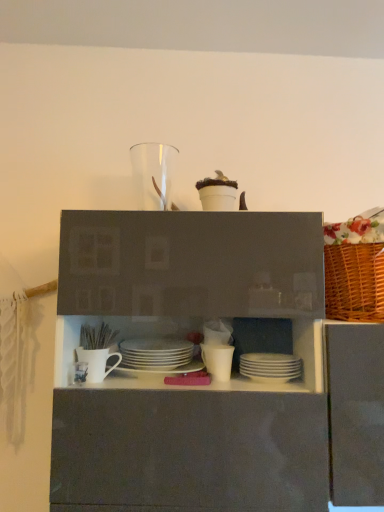
The width and height of the screenshot is (384, 512). Describe the element at coordinates (218, 360) in the screenshot. I see `white matte cup at center, the fifth tableware positioned from the left` at that location.

At what (x,y) coordinates should I click in order to perform the action: click on transparent glass vase at upper center, which is counted as the 6th tableware, starting from the bottom. Please return your answer as a coordinate pair (x, y). Looking at the image, I should click on (153, 174).

The image size is (384, 512). What do you see at coordinates (80, 372) in the screenshot? I see `white matte mug at center, acting as the 4th tableware starting from the top` at bounding box center [80, 372].

Where is `white matte mug at center, acting as the 3th tableware starting from the bottom`? The image size is (384, 512). white matte mug at center, acting as the 3th tableware starting from the bottom is located at coordinates (80, 372).

The width and height of the screenshot is (384, 512). I want to click on white matte mug at center, the 5th tableware from the right, so click(97, 362).

Could you tell me if white matte plates at center, which appears as the 1th tableware when viewed from the right, is turned towards white matte cup at center, the second tableware from the right?

No, white matte plates at center, which appears as the 1th tableware when viewed from the right, is not turned towards white matte cup at center, the second tableware from the right.

Which object is thinner, white matte plates at center, the 1th tableware ordered from the bottom, or white matte cup at center, the second tableware from the right?

With smaller width is white matte plates at center, the 1th tableware ordered from the bottom.

Are white matte plates at center, which is the 6th tableware from left to right, and white matte cup at center, the 2th tableware from the bottom, located far from each other?

They are positioned close to each other.

From a real-world perspective, is white glossy plates at center, arranged as the 3th tableware when viewed from the top, physically located above or below white matte mug at center, arranged as the 6th tableware when viewed from the right?

white glossy plates at center, arranged as the 3th tableware when viewed from the top, is above white matte mug at center, arranged as the 6th tableware when viewed from the right.

Which object is positioned more to the left, white glossy plates at center, arranged as the 3th tableware when viewed from the top, or white matte mug at center, the 1th tableware viewed from the left?

white matte mug at center, the 1th tableware viewed from the left, is more to the left.

From the image's perspective, count 1st tablewares downward from the white glossy plates at center, arranged as the 3th tableware when viewed from the top, and point to it. Please provide its 2D coordinates.

[(80, 372)]

Are white glossy plates at center, arranged as the 3th tableware when viewed from the top, and white matte mug at center, the 1th tableware viewed from the left, beside each other?

No, white glossy plates at center, arranged as the 3th tableware when viewed from the top, is not next to white matte mug at center, the 1th tableware viewed from the left.

From a real-world perspective, which tableware is the 4th one above the white matte plates at center, the sixth tableware positioned from the top? Please provide its 2D coordinates.

[(156, 353)]

Which is behind, point (250, 356) or point (156, 361)?

The point (156, 361) is more distant.

Which of these two, white matte plates at center, the 1th tableware ordered from the bottom, or white glossy plates at center, arranged as the 3th tableware when viewed from the top, is bigger?

With larger size is white glossy plates at center, arranged as the 3th tableware when viewed from the top.

Who is taller, white matte plates at center, the sixth tableware positioned from the top, or white glossy plates at center, marked as the fourth tableware in a bottom-to-top arrangement?

white matte plates at center, the sixth tableware positioned from the top.

From the image's perspective, would you say white matte mug at center, which is the second tableware from top to bottom, is positioned over white matte mug at center, acting as the 3th tableware starting from the bottom?

Correct, white matte mug at center, which is the second tableware from top to bottom, appears higher than white matte mug at center, acting as the 3th tableware starting from the bottom, in the image.

How many degrees apart are the facing directions of white matte mug at center, which is the second tableware from top to bottom, and white matte mug at center, acting as the 4th tableware starting from the top?

The angle between the facing direction of white matte mug at center, which is the second tableware from top to bottom, and the facing direction of white matte mug at center, acting as the 4th tableware starting from the top, is 0.000236 degrees.

Is white matte mug at center, arranged as the 6th tableware when viewed from the right, a part of white matte mug at center, which is the second tableware from top to bottom?

No, white matte mug at center, arranged as the 6th tableware when viewed from the right, is located outside of white matte mug at center, which is the second tableware from top to bottom.

Would you say white matte mug at center, which is the second tableware from top to bottom, is to the left or to the right of white matte mug at center, arranged as the 6th tableware when viewed from the right, in the picture?

From the image, it's evident that white matte mug at center, which is the second tableware from top to bottom, is to the right of white matte mug at center, arranged as the 6th tableware when viewed from the right.

From a real-world perspective, relative to white matte mug at center, the 5th tableware from the right, is white matte cup at center, which is the fifth tableware in top-to-bottom order, vertically above or below?

Clearly, from a real-world perspective, white matte cup at center, which is the fifth tableware in top-to-bottom order, is below white matte mug at center, the 5th tableware from the right.

Which object is thinner, white matte cup at center, the second tableware from the right, or white matte mug at center, which is the second tableware from top to bottom?

Thinner between the two is white matte cup at center, the second tableware from the right.

Based on the photo, from the image's perspective, is white matte cup at center, the 2th tableware from the bottom, on white matte mug at center, positioned as the fifth tableware in bottom-to-top order?

No, from the image's perspective, white matte cup at center, the 2th tableware from the bottom, is not above white matte mug at center, positioned as the fifth tableware in bottom-to-top order.

Does point (202, 357) come farther from viewer compared to point (100, 369)?

Yes, point (202, 357) is behind point (100, 369).

The image size is (384, 512). I want to click on tableware that appears below the white matte mug at center, acting as the 3th tableware starting from the bottom (from a real-world perspective), so pyautogui.click(x=270, y=367).

Which of these two, white matte mug at center, arranged as the 6th tableware when viewed from the right, or white matte plates at center, the 1th tableware ordered from the bottom, stands taller?

Standing taller between the two is white matte plates at center, the 1th tableware ordered from the bottom.

Between white matte mug at center, the 1th tableware viewed from the left, and white matte plates at center, the sixth tableware positioned from the top, which one has smaller width?

Thinner between the two is white matte mug at center, the 1th tableware viewed from the left.

From a real-world perspective, which object stands above the other?

white matte mug at center, arranged as the 6th tableware when viewed from the right, is physically above.

Does transparent glass vase at upper center, the fourth tableware viewed from the right, have a lesser width compared to white glossy plates at center, marked as the fourth tableware in a bottom-to-top arrangement?

Yes, transparent glass vase at upper center, the fourth tableware viewed from the right, is thinner than white glossy plates at center, marked as the fourth tableware in a bottom-to-top arrangement.

Based on the photo, considering the relative positions of transparent glass vase at upper center, the fourth tableware viewed from the right, and white glossy plates at center, arranged as the 3th tableware when viewed from the top, in the image provided, is transparent glass vase at upper center, the fourth tableware viewed from the right, to the left or to the right of white glossy plates at center, arranged as the 3th tableware when viewed from the top,?

Clearly, transparent glass vase at upper center, the fourth tableware viewed from the right, is on the left of white glossy plates at center, arranged as the 3th tableware when viewed from the top, in the image.

Does point (165, 145) come behind point (131, 359)?

Yes.

Where is `the 1st tableware to the left of the white matte plates at center, which is the 6th tableware from left to right, counting from the anchor's position`? the 1st tableware to the left of the white matte plates at center, which is the 6th tableware from left to right, counting from the anchor's position is located at coordinates (218, 360).

Locate an element on the screen. The height and width of the screenshot is (512, 384). the 4th tableware behind the white matte mug at center, the 1th tableware viewed from the left, counting from the anchor's position is located at coordinates (156, 353).

Estimate the real-world distances between objects in this image. Which object is further from white matte mug at center, acting as the 4th tableware starting from the top, white matte cup at center, which is the fifth tableware in top-to-bottom order, or white matte mug at center, which is the second tableware from top to bottom?

The object further to white matte mug at center, acting as the 4th tableware starting from the top, is white matte cup at center, which is the fifth tableware in top-to-bottom order.

Looking at the image, which one is located closer to transparent glass vase at upper center, the fourth tableware viewed from the right, white matte plates at center, which is the 6th tableware from left to right, or white matte mug at center, which is the second tableware from top to bottom?

Based on the image, white matte mug at center, which is the second tableware from top to bottom, appears to be nearer to transparent glass vase at upper center, the fourth tableware viewed from the right.

When comparing their distances from white matte mug at center, acting as the 3th tableware starting from the bottom, does white glossy plates at center, marked as the fourth tableware in a bottom-to-top arrangement, or transparent glass vase at upper center, positioned as the first tableware in top-to-bottom order, seem closer?

white glossy plates at center, marked as the fourth tableware in a bottom-to-top arrangement, is closer to white matte mug at center, acting as the 3th tableware starting from the bottom.

Looking at the image, which one is located further to white matte mug at center, which is the second tableware from top to bottom, white matte cup at center, which is the fifth tableware in top-to-bottom order, or white glossy plates at center, the 3th tableware from the right?

The object further to white matte mug at center, which is the second tableware from top to bottom, is white matte cup at center, which is the fifth tableware in top-to-bottom order.

When comparing their distances from white glossy plates at center, the 3th tableware from the right, does white matte cup at center, the 2th tableware from the bottom, or white matte mug at center, acting as the 4th tableware starting from the top, seem closer?

Based on the image, white matte cup at center, the 2th tableware from the bottom, appears to be nearer to white glossy plates at center, the 3th tableware from the right.

Based on the photo, when comparing their distances from white glossy plates at center, arranged as the 3th tableware when viewed from the top, does white matte plates at center, which appears as the 1th tableware when viewed from the right, or white matte cup at center, which is the fifth tableware in top-to-bottom order, seem further?

white matte plates at center, which appears as the 1th tableware when viewed from the right, lies further to white glossy plates at center, arranged as the 3th tableware when viewed from the top, than the other object.

Estimate the real-world distances between objects in this image. Which object is further from transparent glass vase at upper center, positioned as the first tableware in top-to-bottom order, white matte mug at center, the 5th tableware from the right, or white matte mug at center, acting as the 3th tableware starting from the bottom?

Based on the image, white matte mug at center, acting as the 3th tableware starting from the bottom, appears to be further to transparent glass vase at upper center, positioned as the first tableware in top-to-bottom order.

From the image, which object appears to be farther from white glossy plates at center, marked as the fourth tableware in a bottom-to-top arrangement, white matte cup at center, which is the fifth tableware in top-to-bottom order, or white matte plates at center, which appears as the 1th tableware when viewed from the right?

white matte plates at center, which appears as the 1th tableware when viewed from the right, is positioned further to the anchor white glossy plates at center, marked as the fourth tableware in a bottom-to-top arrangement.

You are a GUI agent. You are given a task and a screenshot of the screen. Output one action in this format:
    pyautogui.click(x=<x>, y=<y>)
    Task: Click on the tableware that lies between transparent glass vase at upper center, the fourth tableware viewed from the right, and white glossy plates at center, the 3th tableware from the right, from top to bottom
    
    Given the screenshot: What is the action you would take?
    pyautogui.click(x=97, y=362)

Where is `tableware between white glossy plates at center, the 3th tableware from the right, and white matte plates at center, which is the 6th tableware from left to right, from left to right`? The image size is (384, 512). tableware between white glossy plates at center, the 3th tableware from the right, and white matte plates at center, which is the 6th tableware from left to right, from left to right is located at coordinates (218, 360).